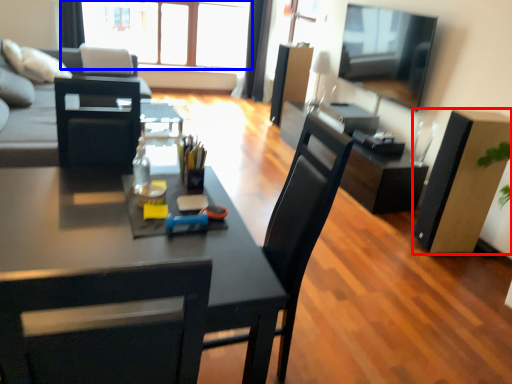
Question: Which object appears farthest to the camera in this image, box (highlighted by a red box) or window (highlighted by a blue box)?

Choices:
 (A) box
 (B) window

Answer: (B)